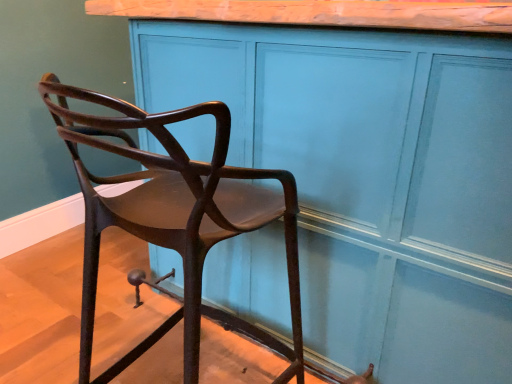
What do you see at coordinates (174, 217) in the screenshot?
I see `matte brown chair at left` at bounding box center [174, 217].

Image resolution: width=512 pixels, height=384 pixels. Identify the location of matte brown chair at left. tap(174, 217).

This screenshot has height=384, width=512. What do you see at coordinates (371, 179) in the screenshot?
I see `matte wood cabinet at center` at bounding box center [371, 179].

You are a GUI agent. You are given a task and a screenshot of the screen. Output one action in this format:
    pyautogui.click(x=<x>, y=<y>)
    Task: Click on the matte wood cabinet at center
    
    Given the screenshot: What is the action you would take?
    pyautogui.click(x=371, y=179)

At what (x,y) coordinates should I click in order to perform the action: click on matte brown chair at left. Please return your answer as a coordinate pair (x, y). The height and width of the screenshot is (384, 512). Looking at the image, I should click on (174, 217).

Which is more to the right, matte wood cabinet at center or matte brown chair at left?

matte wood cabinet at center is more to the right.

Consider the image. Does matte wood cabinet at center lie behind matte brown chair at left?

That is True.

Does point (190, 146) come behind point (191, 295)?

That is True.

From the image's perspective, is matte wood cabinet at center positioned above or below matte brown chair at left?

From the image's perspective, matte wood cabinet at center appears above matte brown chair at left.

From a real-world perspective, is matte wood cabinet at center below matte brown chair at left?

No, from a real-world perspective, matte wood cabinet at center is not under matte brown chair at left.

Is matte wood cabinet at center thinner than matte brown chair at left?

Incorrect, the width of matte wood cabinet at center is not less than that of matte brown chair at left.

Which of these two, matte wood cabinet at center or matte brown chair at left, stands shorter?

matte brown chair at left is shorter.

Looking at this image, in terms of size, does matte wood cabinet at center appear bigger or smaller than matte brown chair at left?

In the image, matte wood cabinet at center appears to be larger than matte brown chair at left.

Is matte wood cabinet at center spatially inside matte brown chair at left, or outside of it?

matte wood cabinet at center lies outside matte brown chair at left.

Are matte wood cabinet at center and matte brown chair at left making contact?

No, matte wood cabinet at center is not beside matte brown chair at left.

Is matte wood cabinet at center looking in the opposite direction of matte brown chair at left?

Yes, matte wood cabinet at center is facing away from matte brown chair at left.

What's the angular difference between matte wood cabinet at center and matte brown chair at left's facing directions?

They differ by 2.01 degrees in their facing directions.

How far apart are matte wood cabinet at center and matte brown chair at left?

A distance of 11.11 inches exists between matte wood cabinet at center and matte brown chair at left.

What are the coordinates of `chair lying on the left of matte wood cabinet at center` in the screenshot? It's located at (174, 217).

Is matte brown chair at left at the right side of matte wood cabinet at center?

In fact, matte brown chair at left is to the left of matte wood cabinet at center.

From the picture: Considering the positions of objects matte brown chair at left and matte wood cabinet at center in the image provided, who is behind, matte brown chair at left or matte wood cabinet at center?

matte wood cabinet at center is further away from the camera.

Which is behind, point (106, 209) or point (444, 142)?

The point (444, 142) is farther.

From the image's perspective, is matte brown chair at left above or below matte wood cabinet at center?

Based on their image positions, matte brown chair at left is located beneath matte wood cabinet at center.

From a real-world perspective, which object rests below the other?

matte brown chair at left, from a real-world perspective.

Does matte brown chair at left have a greater width compared to matte wood cabinet at center?

In fact, matte brown chair at left might be narrower than matte wood cabinet at center.

Which of these two, matte brown chair at left or matte wood cabinet at center, stands taller?

matte wood cabinet at center.

Can you confirm if matte brown chair at left is smaller than matte wood cabinet at center?

Indeed, matte brown chair at left has a smaller size compared to matte wood cabinet at center.

Is matte brown chair at left completely or partially outside of matte wood cabinet at center?

Indeed, matte brown chair at left is completely outside matte wood cabinet at center.

Is matte brown chair at left not near matte wood cabinet at center?

No, matte brown chair at left is not far from matte wood cabinet at center.

Does matte brown chair at left turn towards matte wood cabinet at center?

Yes, matte brown chair at left faces towards matte wood cabinet at center.

What's the angular difference between matte brown chair at left and matte wood cabinet at center's facing directions?

The angular difference between matte brown chair at left and matte wood cabinet at center is 2.01 degrees.

Locate an element on the screen. This screenshot has height=384, width=512. chair below the matte wood cabinet at center (from a real-world perspective) is located at coordinates (174, 217).

You are a GUI agent. You are given a task and a screenshot of the screen. Output one action in this format:
    pyautogui.click(x=<x>, y=<y>)
    Task: Click on the chair in front of the matte wood cabinet at center
    This screenshot has width=512, height=384.
    Given the screenshot: What is the action you would take?
    pyautogui.click(x=174, y=217)

I want to click on chair below the matte wood cabinet at center (from the image's perspective), so click(174, 217).